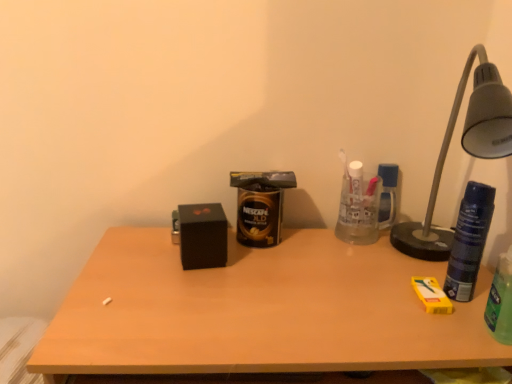
Locate an element on the screen. This screenshot has width=512, height=384. free space between blue textured can at right, arranged as the 2th beverage when viewed from the left, and black matte box at center is located at coordinates (309, 272).